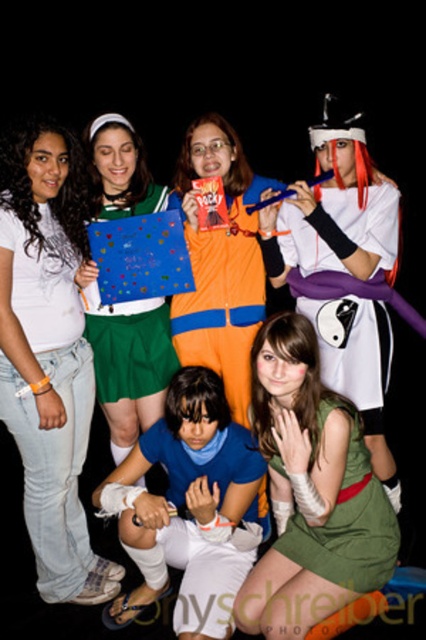
Question: Is green satin dress at center below green fabric dress at lower right?

Choices:
 (A) no
 (B) yes

Answer: (A)

Question: Is the position of orange fabric jacket at center more distant than that of matte green skirt at center?

Choices:
 (A) no
 (B) yes

Answer: (B)

Question: Which object is farther from the camera taking this photo?

Choices:
 (A) matte green skirt at center
 (B) blue fabric shirt at center

Answer: (A)

Question: Is white matte t-shirt at upper left above orange fabric jacket at center?

Choices:
 (A) yes
 (B) no

Answer: (B)

Question: Which point appears farthest from the camera in this image?

Choices:
 (A) [x=233, y=426]
 (B) [x=293, y=522]
 (C) [x=112, y=314]
 (D) [x=16, y=134]

Answer: (C)

Question: Which object appears closest to the camera in this image?

Choices:
 (A) orange fabric jacket at center
 (B) matte green skirt at center

Answer: (B)